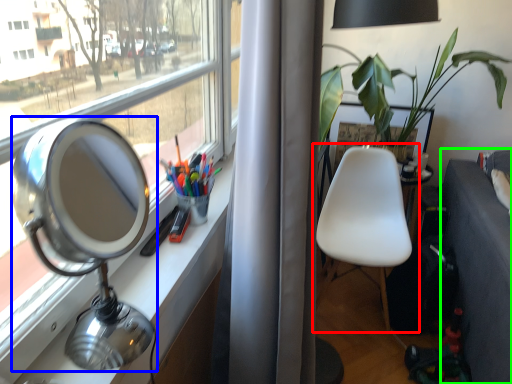
Question: Based on their relative distances, which object is farther from chair (highlighted by a red box)? Choose from table lamp (highlighted by a blue box) and studio couch (highlighted by a green box).

Choices:
 (A) table lamp
 (B) studio couch

Answer: (A)